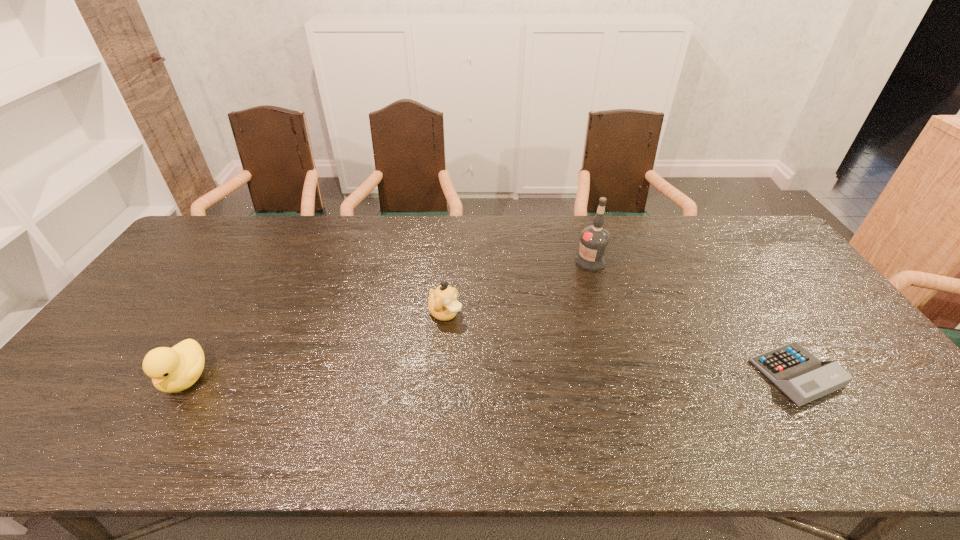
Where is `free space on the desktop that is between the duck and the shortest object and is positioned on the face of the third object from right to left`? The height and width of the screenshot is (540, 960). free space on the desktop that is between the duck and the shortest object and is positioned on the face of the third object from right to left is located at coordinates (529, 375).

Identify the location of free spot on the desktop that is between the leftmost object and the shortest object and is positioned on the front label of the third object from left to right. The image size is (960, 540). (543, 375).